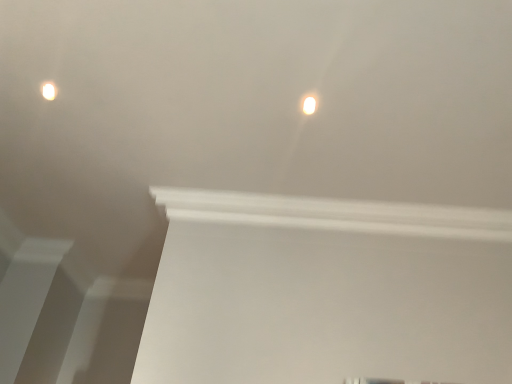
Question: Which direction should I rotate to look at white glossy light fixture at upper center, the 1th lamp in the front-to-back sequence?

Choices:
 (A) right
 (B) left

Answer: (A)

Question: From the image's perspective, is white glossy light fixture at upper center, arranged as the second lamp when viewed from the top, on top of matte white light fixture at upper left, the second lamp viewed from the right?

Choices:
 (A) no
 (B) yes

Answer: (A)

Question: Is white glossy light fixture at upper center, the 1th lamp in the front-to-back sequence, positioned before matte white light fixture at upper left, the second lamp positioned from the front?

Choices:
 (A) yes
 (B) no

Answer: (A)

Question: Is white glossy light fixture at upper center, the first lamp viewed from the right, oriented away from matte white light fixture at upper left, acting as the 1th lamp starting from the top?

Choices:
 (A) yes
 (B) no

Answer: (B)

Question: Considering the relative sizes of white glossy light fixture at upper center, marked as the second lamp in a left-to-right arrangement, and matte white light fixture at upper left, which ranks as the first lamp in back-to-front order, in the image provided, is white glossy light fixture at upper center, marked as the second lamp in a left-to-right arrangement, wider than matte white light fixture at upper left, which ranks as the first lamp in back-to-front order,?

Choices:
 (A) no
 (B) yes

Answer: (B)

Question: Considering the relative sizes of white glossy light fixture at upper center, positioned as the first lamp in bottom-to-top order, and matte white light fixture at upper left, the second lamp viewed from the right, in the image provided, is white glossy light fixture at upper center, positioned as the first lamp in bottom-to-top order, shorter than matte white light fixture at upper left, the second lamp viewed from the right,?

Choices:
 (A) no
 (B) yes

Answer: (B)

Question: From the image's perspective, is white glossy light fixture at upper center, arranged as the second lamp when viewed from the top, located beneath matte white light fixture at upper left, the 2th lamp ordered from the bottom?

Choices:
 (A) yes
 (B) no

Answer: (A)

Question: From the image's perspective, is matte white light fixture at upper left, which ranks as the first lamp in back-to-front order, over white glossy light fixture at upper center, arranged as the second lamp when viewed from the top?

Choices:
 (A) yes
 (B) no

Answer: (A)

Question: From a real-world perspective, is matte white light fixture at upper left, acting as the 1th lamp starting from the top, over white glossy light fixture at upper center, positioned as the first lamp in bottom-to-top order?

Choices:
 (A) yes
 (B) no

Answer: (A)

Question: Is matte white light fixture at upper left, which appears as the first lamp when viewed from the left, bigger than white glossy light fixture at upper center, arranged as the second lamp when viewed from the top?

Choices:
 (A) no
 (B) yes

Answer: (B)

Question: Is white glossy light fixture at upper center, which is the second lamp in back-to-front order, located within matte white light fixture at upper left, the second lamp positioned from the front?

Choices:
 (A) no
 (B) yes

Answer: (A)

Question: Is matte white light fixture at upper left, acting as the 1th lamp starting from the top, smaller than white glossy light fixture at upper center, the first lamp viewed from the right?

Choices:
 (A) yes
 (B) no

Answer: (B)

Question: Is matte white light fixture at upper left, which ranks as the first lamp in back-to-front order, behind white glossy light fixture at upper center, positioned as the first lamp in bottom-to-top order?

Choices:
 (A) yes
 (B) no

Answer: (A)

Question: From a real-world perspective, relative to matte white light fixture at upper left, the second lamp positioned from the front, is white glossy light fixture at upper center, positioned as the first lamp in bottom-to-top order, vertically above or below?

Choices:
 (A) below
 (B) above

Answer: (A)